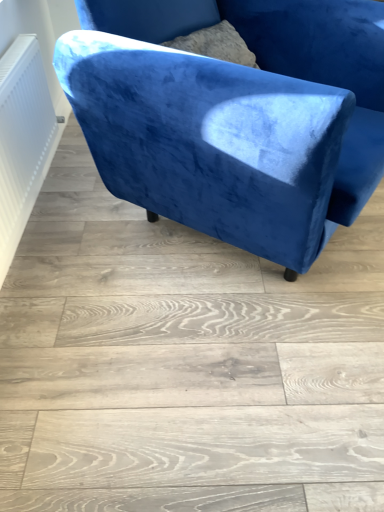
Find the location of a particular element. white textured radiator at left is located at coordinates (22, 139).

Measure the distance between point (x=35, y=35) and camera.

Point (x=35, y=35) and camera are 1.62 meters apart.

What do you see at coordinates (22, 139) in the screenshot? I see `white textured radiator at left` at bounding box center [22, 139].

This screenshot has width=384, height=512. What are the coordinates of `velvet blue armchair at upper center` in the screenshot? It's located at (234, 116).

The image size is (384, 512). What do you see at coordinates (234, 116) in the screenshot?
I see `velvet blue armchair at upper center` at bounding box center [234, 116].

Locate an element on the screen. Image resolution: width=384 pixels, height=512 pixels. white textured radiator at left is located at coordinates (22, 139).

Which object is positioned more to the left, velvet blue armchair at upper center or white textured radiator at left?

white textured radiator at left.

Is the depth of velvet blue armchair at upper center greater than that of white textured radiator at left?

No, it is not.

Does point (219, 139) lie behind point (24, 77)?

No, (219, 139) is closer to viewer.

From the image's perspective, which is above, velvet blue armchair at upper center or white textured radiator at left?

velvet blue armchair at upper center.

From a real-world perspective, which is physically above, velvet blue armchair at upper center or white textured radiator at left?

velvet blue armchair at upper center, from a real-world perspective.

Which object is wider, velvet blue armchair at upper center or white textured radiator at left?

With larger width is velvet blue armchair at upper center.

Can you confirm if velvet blue armchair at upper center is taller than white textured radiator at left?

Yes, velvet blue armchair at upper center is taller than white textured radiator at left.

Considering the sizes of velvet blue armchair at upper center and white textured radiator at left in the image, is velvet blue armchair at upper center bigger or smaller than white textured radiator at left?

velvet blue armchair at upper center is bigger than white textured radiator at left.

Is velvet blue armchair at upper center situated inside white textured radiator at left or outside?

velvet blue armchair at upper center cannot be found inside white textured radiator at left.

Is velvet blue armchair at upper center placed right next to white textured radiator at left?

velvet blue armchair at upper center and white textured radiator at left are clearly separated.

Is velvet blue armchair at upper center turned away from white textured radiator at left?

Absolutely, velvet blue armchair at upper center is directed away from white textured radiator at left.

Find the location of a particular element. The height and width of the screenshot is (512, 384). radiator lying on the left of velvet blue armchair at upper center is located at coordinates (22, 139).

Would you say white textured radiator at left is to the left or to the right of velvet blue armchair at upper center in the picture?

Based on their positions, white textured radiator at left is located to the left of velvet blue armchair at upper center.

Considering the positions of objects white textured radiator at left and velvet blue armchair at upper center in the image provided, who is behind, white textured radiator at left or velvet blue armchair at upper center?

Positioned behind is white textured radiator at left.

Which is farther from the camera, (1, 170) or (360, 93)?

The point (360, 93) is more distant.

From the image's perspective, which object appears higher, white textured radiator at left or velvet blue armchair at upper center?

velvet blue armchair at upper center, from the image's perspective.

From a real-world perspective, is white textured radiator at left located higher than velvet blue armchair at upper center?

No, from a real-world perspective, white textured radiator at left is not over velvet blue armchair at upper center

Considering the relative sizes of white textured radiator at left and velvet blue armchair at upper center in the image provided, is white textured radiator at left thinner than velvet blue armchair at upper center?

Yes.

Who is shorter, white textured radiator at left or velvet blue armchair at upper center?

white textured radiator at left.

Considering the sizes of objects white textured radiator at left and velvet blue armchair at upper center in the image provided, who is smaller, white textured radiator at left or velvet blue armchair at upper center?

white textured radiator at left.

Would you say white textured radiator at left is inside or outside velvet blue armchair at upper center?

white textured radiator at left is not enclosed by velvet blue armchair at upper center.

Is white textured radiator at left directly adjacent to velvet blue armchair at upper center?

They are not placed beside each other.

Is white textured radiator at left facing towards velvet blue armchair at upper center?

Yes.

How different are the orientations of white textured radiator at left and velvet blue armchair at upper center in degrees?

The angular difference between white textured radiator at left and velvet blue armchair at upper center is 33.6 degrees.

Where is `radiator that is on the left side of velvet blue armchair at upper center`? This screenshot has width=384, height=512. radiator that is on the left side of velvet blue armchair at upper center is located at coordinates (22, 139).

Where is `chair located on the right of white textured radiator at left`? The width and height of the screenshot is (384, 512). chair located on the right of white textured radiator at left is located at coordinates (234, 116).

Where is `radiator that appears below the velvet blue armchair at upper center (from a real-world perspective)`? Image resolution: width=384 pixels, height=512 pixels. radiator that appears below the velvet blue armchair at upper center (from a real-world perspective) is located at coordinates (22, 139).